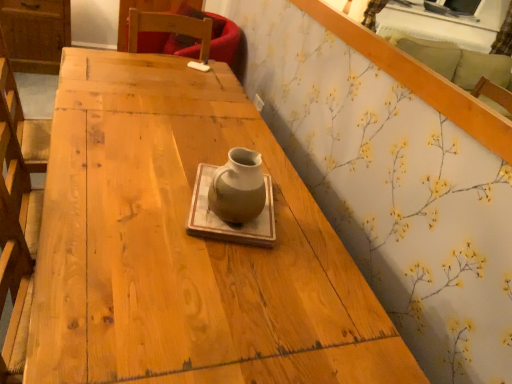
Image resolution: width=512 pixels, height=384 pixels. I want to click on matte ceramic vase at center, so [x=238, y=187].

Measure the distance between matte ceramic vase at center and camera.

matte ceramic vase at center and camera are 1.00 meters apart.

What do you see at coordinates (238, 187) in the screenshot?
I see `matte ceramic vase at center` at bounding box center [238, 187].

The height and width of the screenshot is (384, 512). In order to click on white floral wallpaper at upper right in this screenshot , I will do `click(419, 80)`.

Describe the element at coordinates (419, 80) in the screenshot. The height and width of the screenshot is (384, 512). I see `white floral wallpaper at upper right` at that location.

Where is `matte ceramic vase at center`? This screenshot has height=384, width=512. matte ceramic vase at center is located at coordinates (238, 187).

Consider the image. Would you say matte ceramic vase at center is to the left or to the right of white floral wallpaper at upper right in the picture?

matte ceramic vase at center is to the left of white floral wallpaper at upper right.

Which object is further away from the camera taking this photo, matte ceramic vase at center or white floral wallpaper at upper right?

matte ceramic vase at center is more distant.

From the picture: Which is closer, (x=220, y=170) or (x=505, y=133)?

Point (x=220, y=170).

From the image's perspective, who appears lower, matte ceramic vase at center or white floral wallpaper at upper right?

From the image's view, matte ceramic vase at center is below.

From a real-world perspective, who is located lower, matte ceramic vase at center or white floral wallpaper at upper right?

matte ceramic vase at center.

Considering the relative sizes of matte ceramic vase at center and white floral wallpaper at upper right in the image provided, is matte ceramic vase at center wider than white floral wallpaper at upper right?

Indeed, matte ceramic vase at center has a greater width compared to white floral wallpaper at upper right.

Does matte ceramic vase at center have a lesser height compared to white floral wallpaper at upper right?

Yes, matte ceramic vase at center is shorter than white floral wallpaper at upper right.

From the picture: Can you confirm if matte ceramic vase at center is bigger than white floral wallpaper at upper right?

No.

Is matte ceramic vase at center positioned beyond the bounds of white floral wallpaper at upper right?

matte ceramic vase at center lies outside white floral wallpaper at upper right's area.

Is matte ceramic vase at center with white floral wallpaper at upper right?

matte ceramic vase at center is not next to white floral wallpaper at upper right, and they're not touching.

From the picture: Is matte ceramic vase at center oriented towards white floral wallpaper at upper right?

No, matte ceramic vase at center does not turn towards white floral wallpaper at upper right.

What's the angular difference between matte ceramic vase at center and white floral wallpaper at upper right's facing directions?

The facing directions of matte ceramic vase at center and white floral wallpaper at upper right are 17.9 degrees apart.

How much distance is there between matte ceramic vase at center and white floral wallpaper at upper right?

matte ceramic vase at center and white floral wallpaper at upper right are 27.13 inches apart from each other.

Image resolution: width=512 pixels, height=384 pixels. In order to click on vase lying below the white floral wallpaper at upper right (from the image's perspective) in this screenshot , I will do `click(238, 187)`.

Considering the relative positions of white floral wallpaper at upper right and matte ceramic vase at center in the image provided, is white floral wallpaper at upper right to the left of matte ceramic vase at center from the viewer's perspective?

No, white floral wallpaper at upper right is not to the left of matte ceramic vase at center.

Considering their positions, is white floral wallpaper at upper right located in front of or behind matte ceramic vase at center?

white floral wallpaper at upper right is in front of matte ceramic vase at center.

Which is behind, point (440, 83) or point (261, 209)?

The point (440, 83) is farther from the camera.

From the picture: From the image's perspective, who appears lower, white floral wallpaper at upper right or matte ceramic vase at center?

matte ceramic vase at center.

From a real-world perspective, between white floral wallpaper at upper right and matte ceramic vase at center, who is vertically lower?

In real-world perspective, matte ceramic vase at center is lower.

Considering the sizes of objects white floral wallpaper at upper right and matte ceramic vase at center in the image provided, who is wider, white floral wallpaper at upper right or matte ceramic vase at center?

With larger width is matte ceramic vase at center.

Can you confirm if white floral wallpaper at upper right is taller than matte ceramic vase at center?

Yes, white floral wallpaper at upper right is taller than matte ceramic vase at center.

Considering the sizes of white floral wallpaper at upper right and matte ceramic vase at center in the image, is white floral wallpaper at upper right bigger or smaller than matte ceramic vase at center?

In the image, white floral wallpaper at upper right appears to be larger than matte ceramic vase at center.

Is matte ceramic vase at center located within white floral wallpaper at upper right?

No, white floral wallpaper at upper right does not contain matte ceramic vase at center.

Is white floral wallpaper at upper right far from matte ceramic vase at center?

No, white floral wallpaper at upper right is not far from matte ceramic vase at center.

Does white floral wallpaper at upper right turn towards matte ceramic vase at center?

No, white floral wallpaper at upper right does not turn towards matte ceramic vase at center.

Can you tell me how much white floral wallpaper at upper right and matte ceramic vase at center differ in facing direction?

17.9 degrees separate the facing orientations of white floral wallpaper at upper right and matte ceramic vase at center.

Locate an element on the screen. This screenshot has height=384, width=512. mirror that is above the matte ceramic vase at center (from a real-world perspective) is located at coordinates (419, 80).

Identify the location of mirror located on the right of matte ceramic vase at center. The height and width of the screenshot is (384, 512). (419, 80).

Where is `vase that is behind the white floral wallpaper at upper right`? Image resolution: width=512 pixels, height=384 pixels. vase that is behind the white floral wallpaper at upper right is located at coordinates (238, 187).